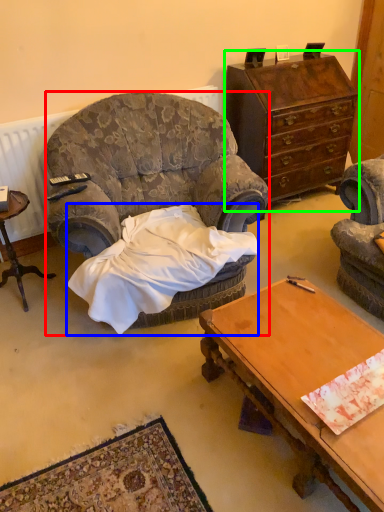
Question: Based on their relative distances, which object is nearer to chair (highlighted by a red box)? Choose from blanket (highlighted by a blue box) and dresser (highlighted by a green box).

Choices:
 (A) blanket
 (B) dresser

Answer: (A)